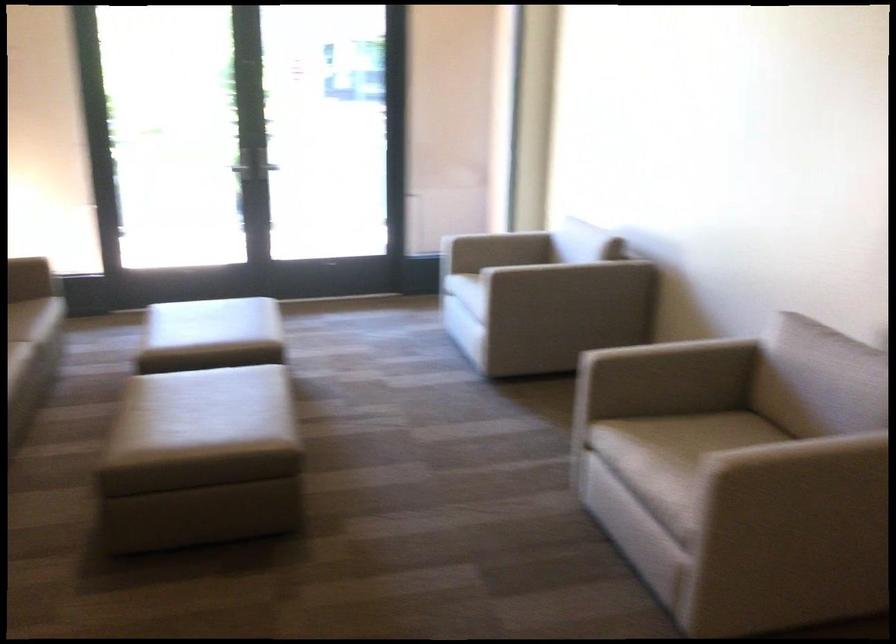
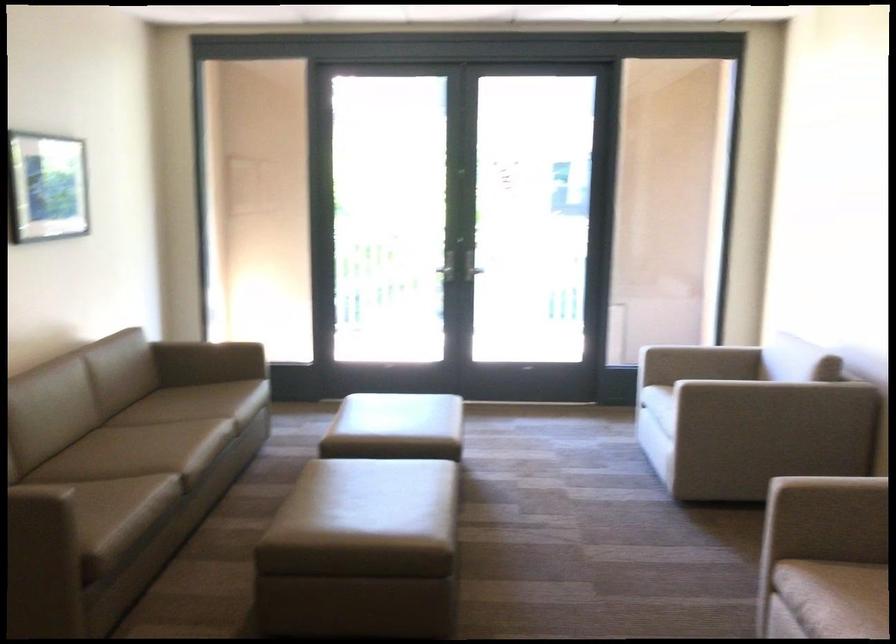
Find the pixel in the second image that matches point 549,225 in the first image.

(762, 346)